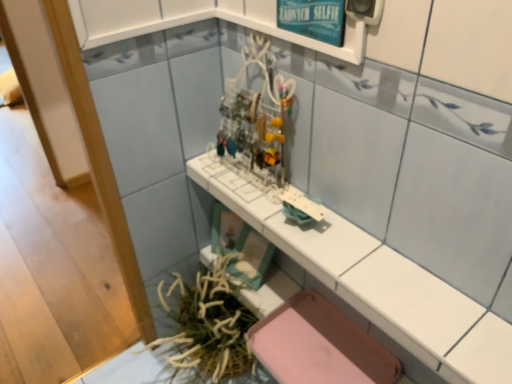
Question: Considering the relative positions of white glossy counter top at center and teal glossy signboard at upper center in the image provided, is white glossy counter top at center to the left of teal glossy signboard at upper center from the viewer's perspective?

Choices:
 (A) no
 (B) yes

Answer: (A)

Question: Is white glossy counter top at center wider than teal glossy signboard at upper center?

Choices:
 (A) no
 (B) yes

Answer: (B)

Question: Does white glossy counter top at center have a lesser height compared to teal glossy signboard at upper center?

Choices:
 (A) no
 (B) yes

Answer: (A)

Question: Does white glossy counter top at center have a greater height compared to teal glossy signboard at upper center?

Choices:
 (A) no
 (B) yes

Answer: (B)

Question: From a real-world perspective, is white glossy counter top at center physically above teal glossy signboard at upper center?

Choices:
 (A) yes
 (B) no

Answer: (B)

Question: Considering the relative sizes of white glossy counter top at center and teal glossy signboard at upper center in the image provided, is white glossy counter top at center smaller than teal glossy signboard at upper center?

Choices:
 (A) yes
 (B) no

Answer: (B)

Question: Is green leafy plant at lower left in front of white glossy counter top at center?

Choices:
 (A) yes
 (B) no

Answer: (B)

Question: Is green leafy plant at lower left positioned behind white glossy counter top at center?

Choices:
 (A) no
 (B) yes

Answer: (B)

Question: From the image's perspective, is green leafy plant at lower left located above white glossy counter top at center?

Choices:
 (A) yes
 (B) no

Answer: (B)

Question: Is green leafy plant at lower left to the left of white glossy counter top at center from the viewer's perspective?

Choices:
 (A) yes
 (B) no

Answer: (A)

Question: Is green leafy plant at lower left looking in the opposite direction of white glossy counter top at center?

Choices:
 (A) yes
 (B) no

Answer: (B)

Question: Does green leafy plant at lower left have a smaller size compared to white glossy counter top at center?

Choices:
 (A) no
 (B) yes

Answer: (A)

Question: From a real-world perspective, does teal glossy signboard at upper center sit lower than white glossy counter top at center?

Choices:
 (A) yes
 (B) no

Answer: (B)